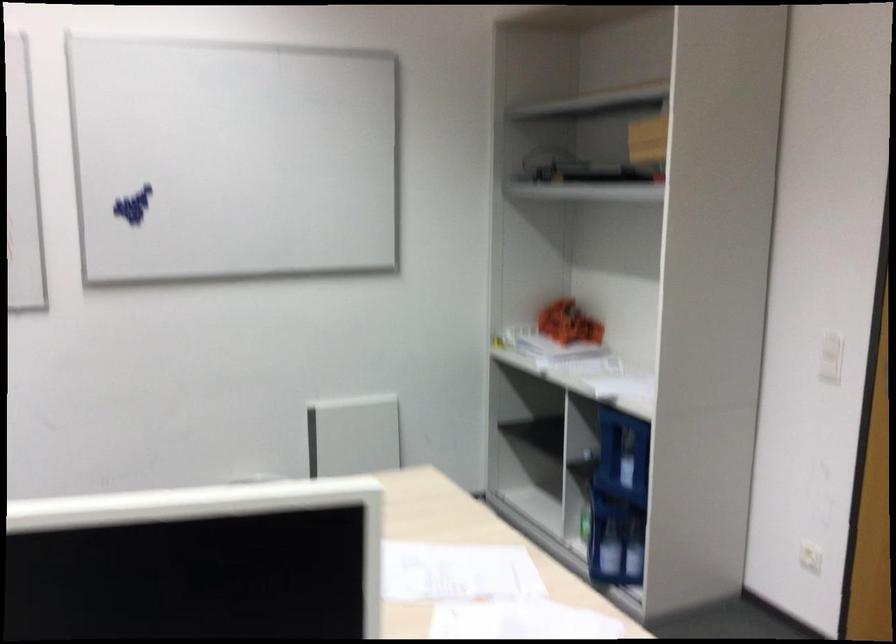
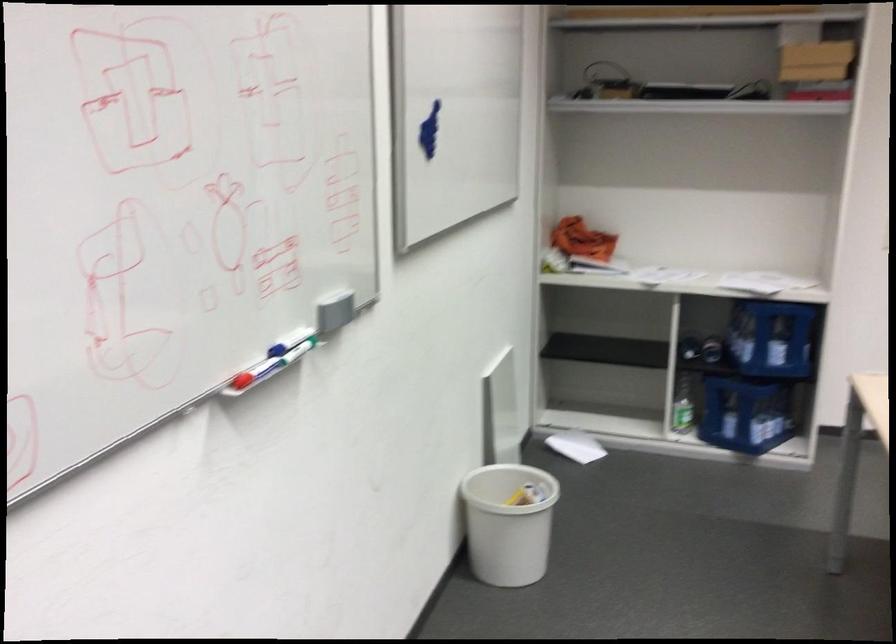
Question: I am providing you with two images of the same scene from different viewpoints. Which of the following objects are not visible in image2?

Choices:
 (A) white paper sheet
 (B) blue bottle crate
 (C) pink dish brush
 (D) blue whiteboard marker

Answer: (B)